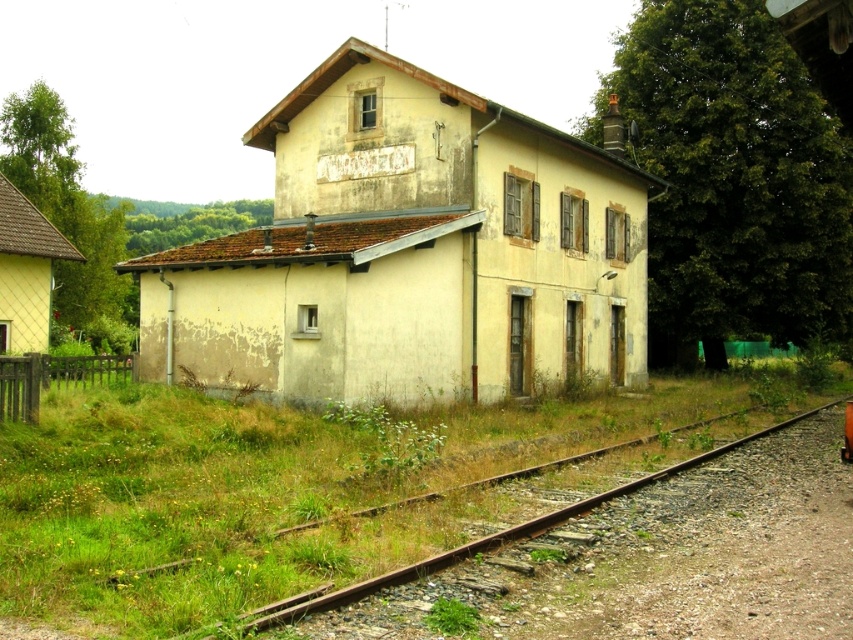
You are a photographer standing near the old building. You want to capture a photo of the orange matte train at lower right while ensuring the rusty metal train track at lower right is visible in the foreground. Is the position of the train track suitable for this?

The rusty metal train track at lower right is located below the orange matte train at lower right, so yes, the photographer can position the camera to include the rusty metal train track at lower right in the foreground while focusing on the orange matte train at lower right.

You are a worker inspecting the railway near the old building. You need to ensure the orange matte train at lower right can fit on the rusty metal train track at lower right. Based on the scene, can the train fit on the track?

The rusty metal train track at lower right is wider than the orange matte train at lower right, so the train should fit on the track since the track is wider than the train.

You are standing at the old weathered building and looking towards the railway. You see the rusty metal train track at lower right and the orange matte train at lower right. Which object is closer to your left side when facing the railway?

The rusty metal train track at lower right is to the left of orange matte train at lower right, so when facing the railway, the rusty metal train track at lower right would be closer to your left side.